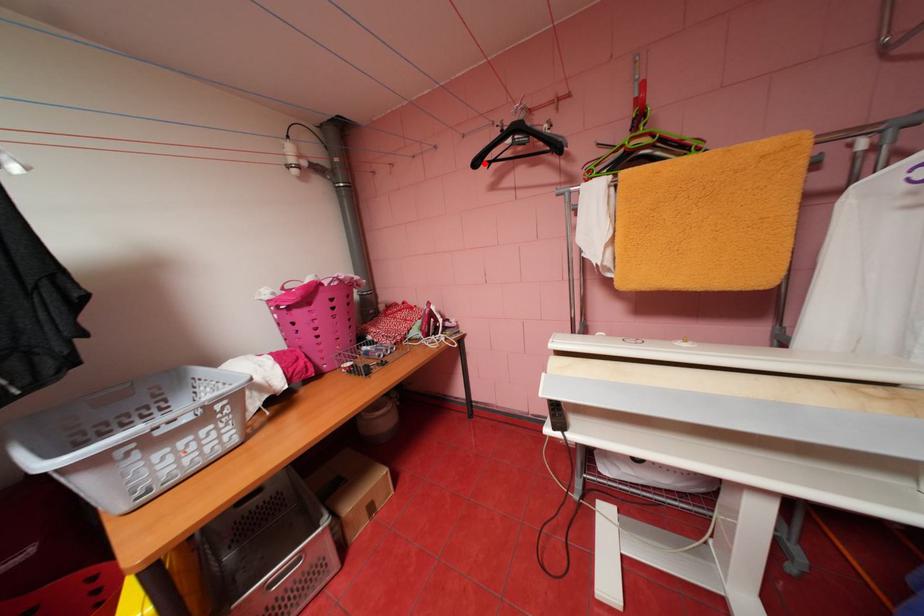
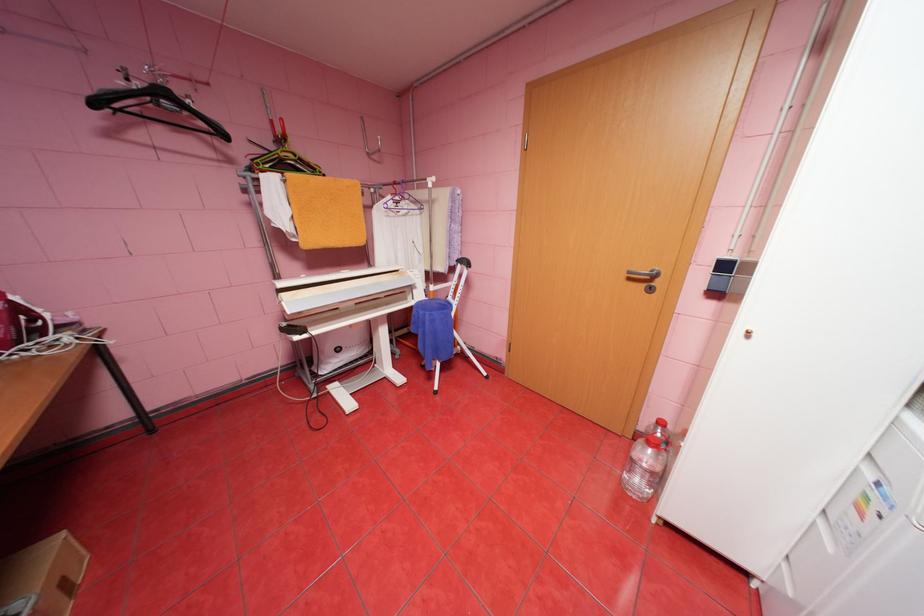
Where in the second image is the point corresponding to the highlighted location from the first image?

(103, 103)